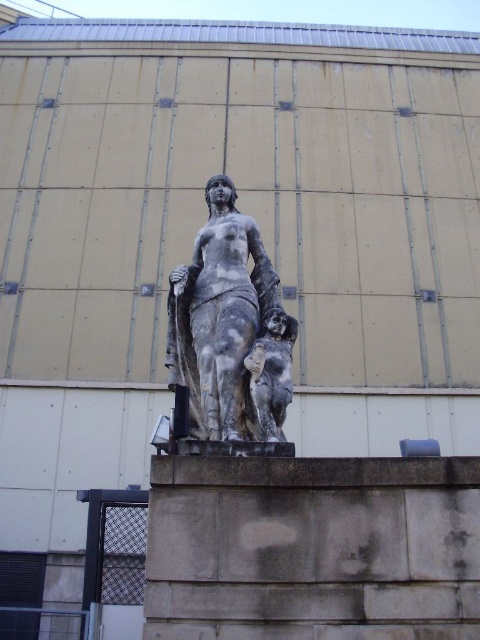
You are standing in front of the statue and want to take a photo. The camera you have can only focus on objects within a 0.45 radius around the center point. Will the marble statue at center be in focus?

The marble statue at center is located at point [220,317], which is within the 0.45 radius from the center point, so it will be in focus.

You are an art conservator assessing the statue. You need to determine which figure is shorter between the marble statue at center and the gray stone cherub at center. Which one is shorter?

The marble statue at center is not as tall as the gray stone cherub at center, so the marble statue at center is shorter.